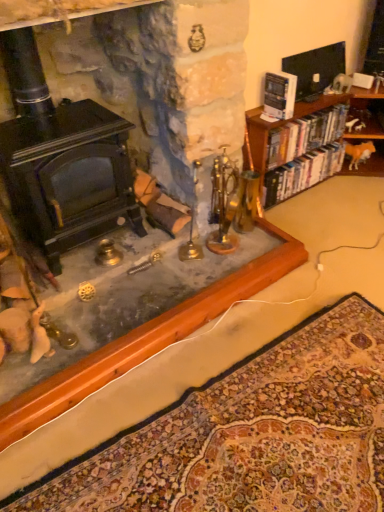
Find the location of a particular element. Image resolution: width=384 pixels, height=512 pixels. vacant region above carpeted mat at lower center (from a real-world perspective) is located at coordinates (263, 424).